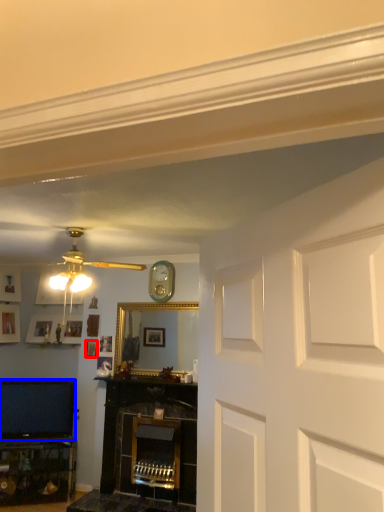
Question: Which object is closer to the camera taking this photo, picture frame (highlighted by a red box) or television (highlighted by a blue box)?

Choices:
 (A) picture frame
 (B) television

Answer: (B)